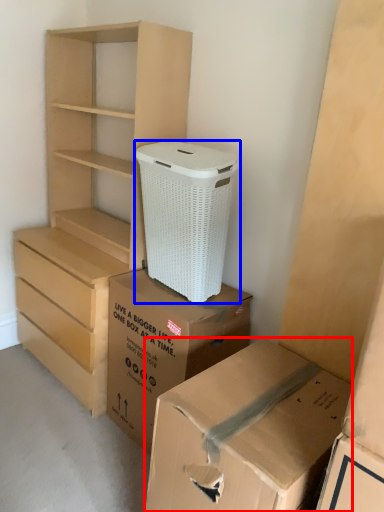
Question: Which object is further to the camera taking this photo, box (highlighted by a red box) or shoe box (highlighted by a blue box)?

Choices:
 (A) box
 (B) shoe box

Answer: (B)